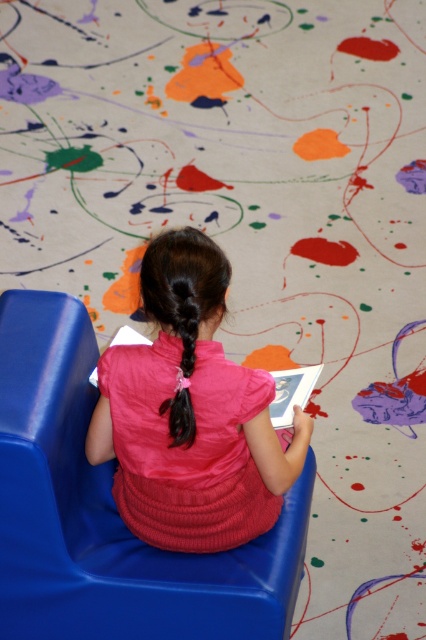
You are a photographer trying to capture the girl in the scene. If you want to focus on the pink satin dress at center without the blue plastic chair at center blocking it, where should you position yourself relative to the girl?

The pink satin dress at center is behind the blue plastic chair at center. To avoid the chair blocking the dress, you should position yourself behind the blue plastic chair at center so that the dress is visible in front of you while the chair is between you and the girl.

You are an interior designer assessing the space where the girl is sitting. You need to place a decorative item between the blue plastic chair at center and the black silky hair at center. Considering their sizes, which object should the decorative item be placed closer to?

The decorative item should be placed closer to the black silky hair at center because the blue plastic chair at center is larger in size and would require more space around it.

You are an interior designer assessing the placement of furniture and clothing in a room. You notice the blue plastic chair at center and the pink satin dress at center. Which object is positioned lower in the scene?

The blue plastic chair at center is located below the pink satin dress at center, so the blue plastic chair at center is positioned lower in the scene.